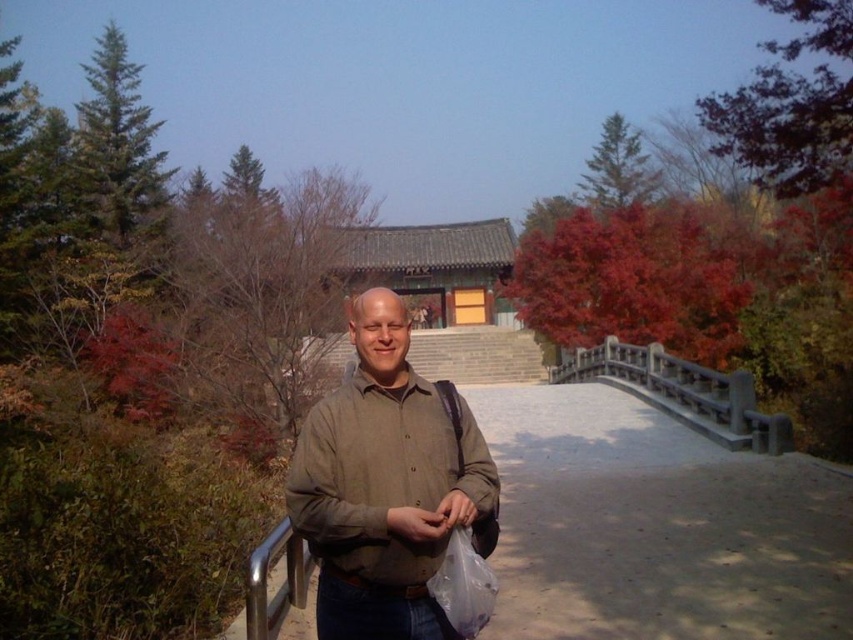
Question: Which point is closer to the camera taking this photo?

Choices:
 (A) (440, 528)
 (B) (257, 600)
 (C) (448, 516)

Answer: (A)

Question: Can you confirm if black stone bridge at center is positioned above silver metallic handrail at lower left?

Choices:
 (A) no
 (B) yes

Answer: (B)

Question: Which of the following is the closest to the observer?

Choices:
 (A) (619, 349)
 (B) (364, 422)

Answer: (B)

Question: Does matte brown shirt at center lie behind matte brown hand at center?

Choices:
 (A) no
 (B) yes

Answer: (B)

Question: Does matte brown hand at center have a greater width compared to translucent plastic bag at lower center?

Choices:
 (A) no
 (B) yes

Answer: (B)

Question: Among these points, which one is farthest from the camera?

Choices:
 (A) (445, 506)
 (B) (325, 595)
 (C) (299, 582)
 (D) (415, 509)

Answer: (C)